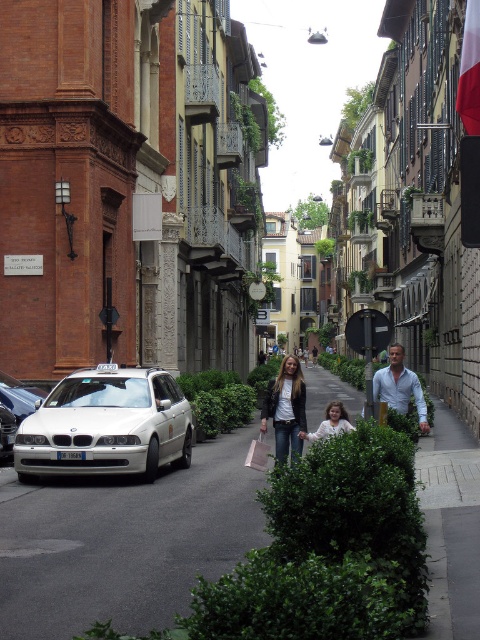
You are a tourist standing on the gray asphalt pavement at center, looking at the white matte shirt at center. Which object is taller?

The white matte shirt at center is taller than the gray asphalt pavement at center.

You are standing at the point marked by the coordinates point (123,541) in the image. What material are you standing on?

The point (123,541) marks gray asphalt pavement at center, so you are standing on asphalt.

You are standing on the narrow street and want to walk from point (84,584) to point (104,417). Which direction should you face to move towards the point that is farther away from you?

You should face away from the viewer because point (104,417) is farther away from you than point (84,584).